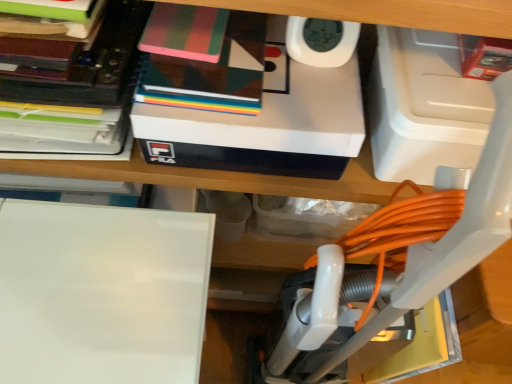
This screenshot has height=384, width=512. What are the coordinates of `empty space that is ontop of white glossy board at lower left (from a real-world perspective)` in the screenshot? It's located at (84, 278).